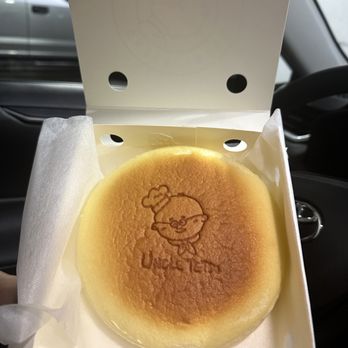
This screenshot has height=348, width=348. I want to click on box, so click(217, 45).